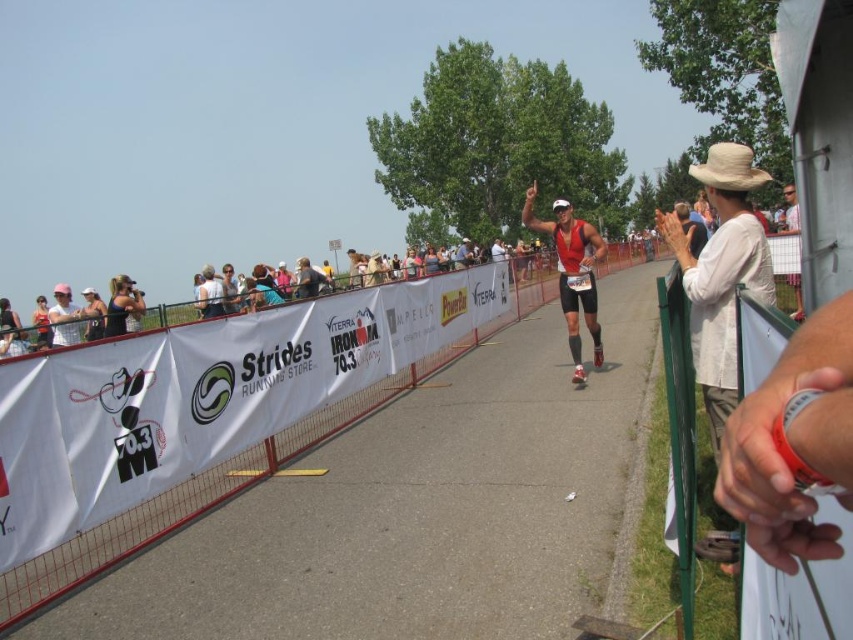
You are a photographer positioned at the finish line of a triathlon. You need to capture a photo that includes both the matte red triathlon suit at center and the white cotton shirt at right. Based on their sizes, which object should you zoom in on to ensure both are clearly visible in the frame?

The matte red triathlon suit at center has a lesser width compared to the white cotton shirt at right. To ensure both are clearly visible, you should zoom in on the white cotton shirt at right since it is wider, allowing the smaller matte red triathlon suit at center to fit within the frame as well.

You are a photographer at the finish line of the triathlon. You need to capture a photo of both the matte red triathlon suit at center and the white cotton shirt at right. Which athlete is closer to the left side of the photo?

The matte red triathlon suit at center is positioned on the left side of the white cotton shirt at right, so the athlete in the matte red triathlon suit at center is closer to the left side of the photo.

You are a photographer positioned at the finish line of the triathlon. You want to take a photo that includes both the point at coordinates point [570,216] and point [788,186]. Which point will appear larger in your photo?

Point [570,216] is closer to the viewer than point [788,186], so it will appear larger in the photo.